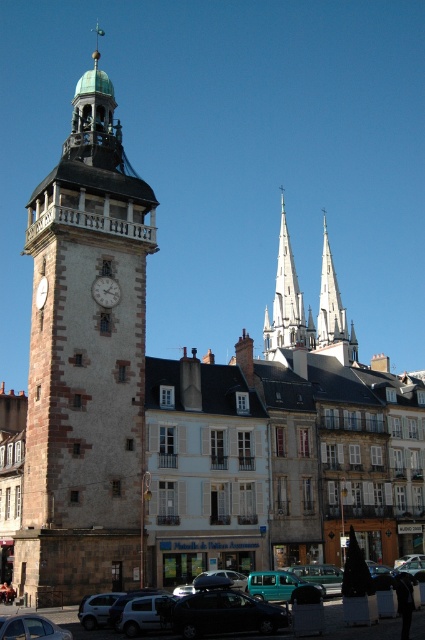
Is matte silver clock at center wider than matte white clock at center-left?

Yes, matte silver clock at center is wider than matte white clock at center-left.

Does matte silver clock at center have a greater height compared to matte white clock at center-left?

No.

I want to click on matte silver clock at center, so click(105, 291).

Who is more forward, [85,323] or [283,584]?

Point [283,584]

Does point (25, 444) lie in front of point (269, 600)?

No, it is behind (269, 600).

Who is more forward, (37, 499) or (252, 589)?

Point (252, 589) is more forward.

Locate an element on the screen. Image resolution: width=425 pixels, height=640 pixels. brown stone clock tower at left is located at coordinates (85, 364).

Which is in front, point (283, 344) or point (104, 284)?

Point (104, 284)

Between point (282, 204) and point (104, 282), which one is positioned in front?

Point (104, 282)

Locate an element on the screen. This screenshot has height=640, width=425. white stone spires at center is located at coordinates (286, 301).